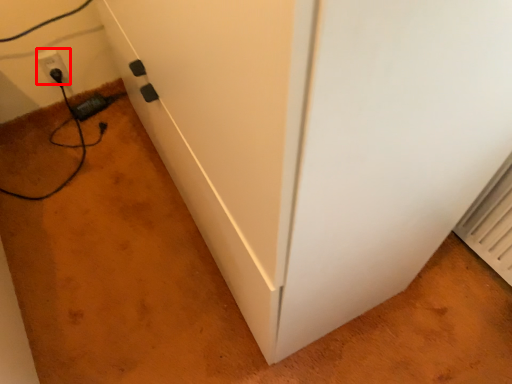
Question: Considering the relative positions of electric outlet (annotated by the red box) and plug in the image provided, where is electric outlet (annotated by the red box) located with respect to the staircase?

Choices:
 (A) left
 (B) right

Answer: (A)